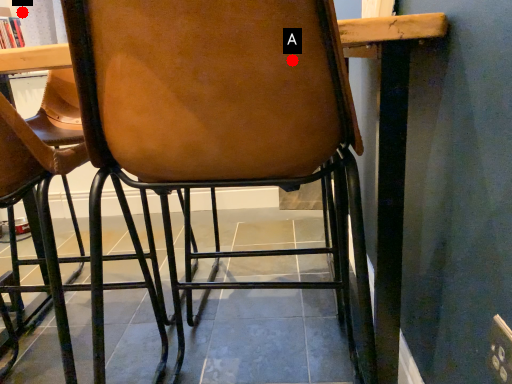
Question: Two points are circled on the image, labeled by A and B beside each circle. Which point is further to the camera?

Choices:
 (A) A is further
 (B) B is further

Answer: (B)